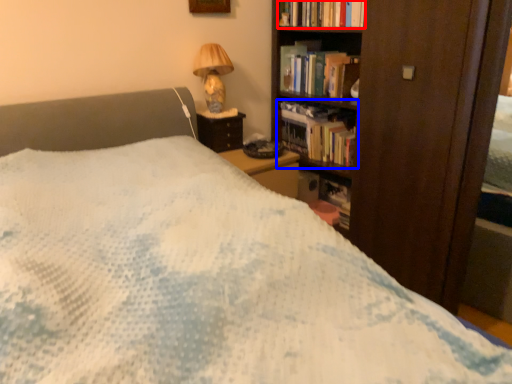
Question: Which of the following is the closest to the observer, book (highlighted by a red box) or book (highlighted by a blue box)?

Choices:
 (A) book
 (B) book

Answer: (A)